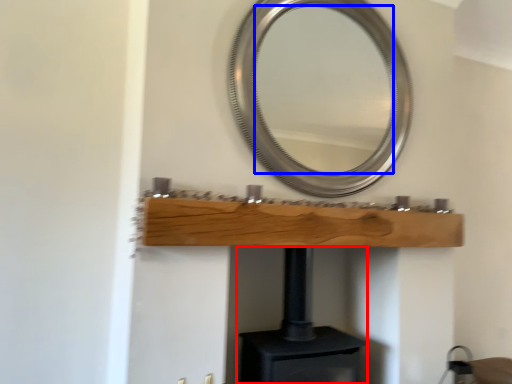
Question: Which point is further to the camera, fireplace (highlighted by a red box) or mirror (highlighted by a blue box)?

Choices:
 (A) fireplace
 (B) mirror

Answer: (B)